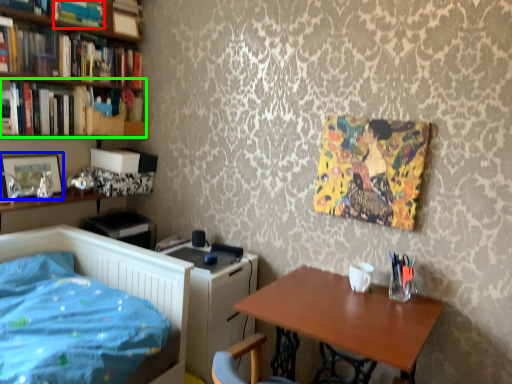
Question: Considering the real-world distances, which object is closest to book (highlighted by a red box)? picture frame (highlighted by a blue box) or book (highlighted by a green box).

Choices:
 (A) picture frame
 (B) book

Answer: (B)